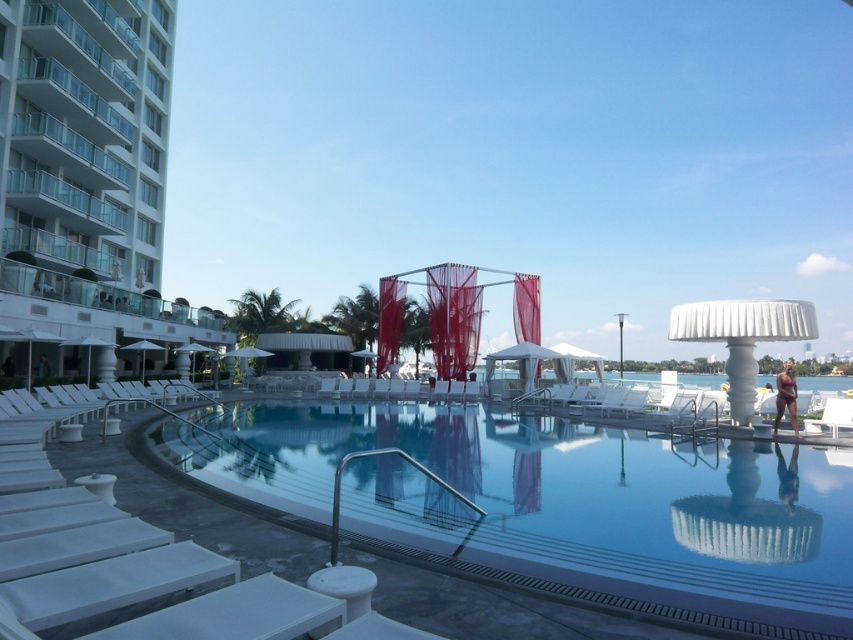
You are standing at the edge of the clear glass pool at center and want to look at the white glass building at left. Which direction should you turn your head to see it?

You should turn your head to the left because the white glass building at left is positioned to the left side of the clear glass pool at center, which is closer to you.

You are standing at the entrance of the pool area and want to swim to the clear glass pool at center. Based on the coordinates provided, in which general direction should you head from your current position?

The clear glass pool at center is located at coordinates point (555, 504), so you should head towards the center of the pool area from the entrance.